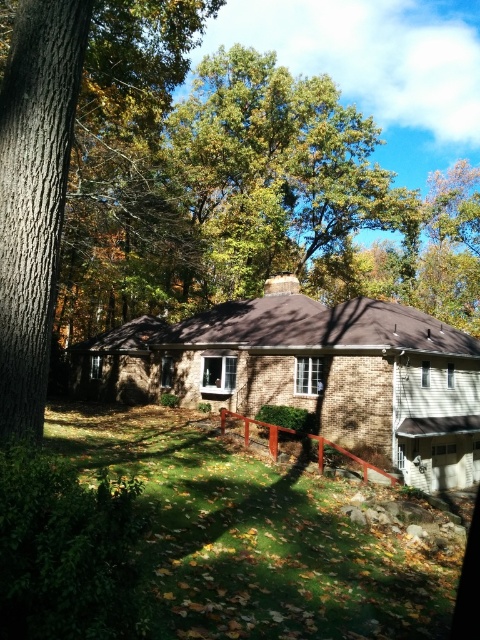
You are standing at the edge of the suburban lawn and want to walk towards the house. According to the image, where is the green grass at lower center located in relation to your current position?

The green grass at lower center is located at point (214, 545), so it is ahead of your current position at the edge of the lawn.

You are a gardener who wants to mow the lawn. You notice the green grass at lower center and the smooth brown bark at left. Which area needs mowing first based on their height?

The green grass at lower center needs mowing first because it is much taller than the smooth brown bark at left.